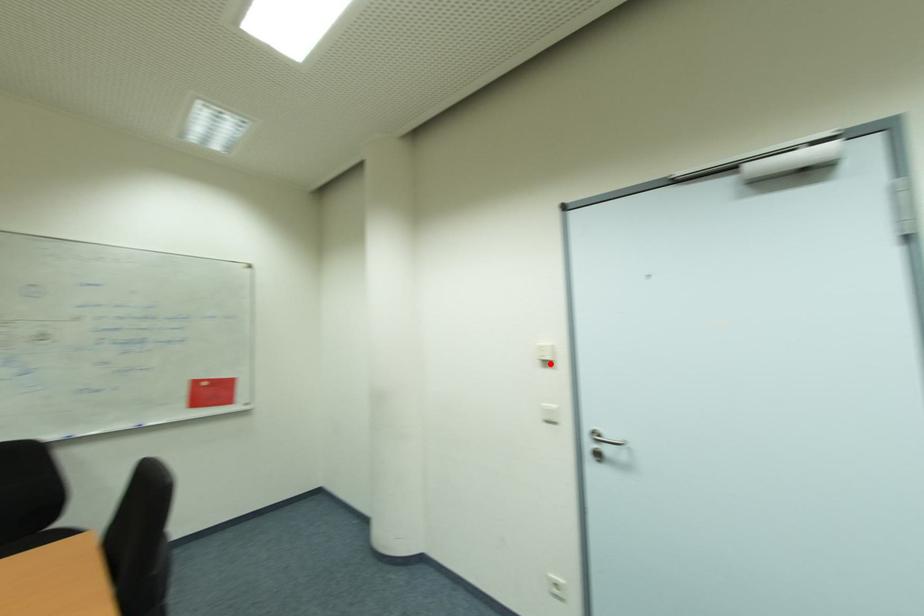
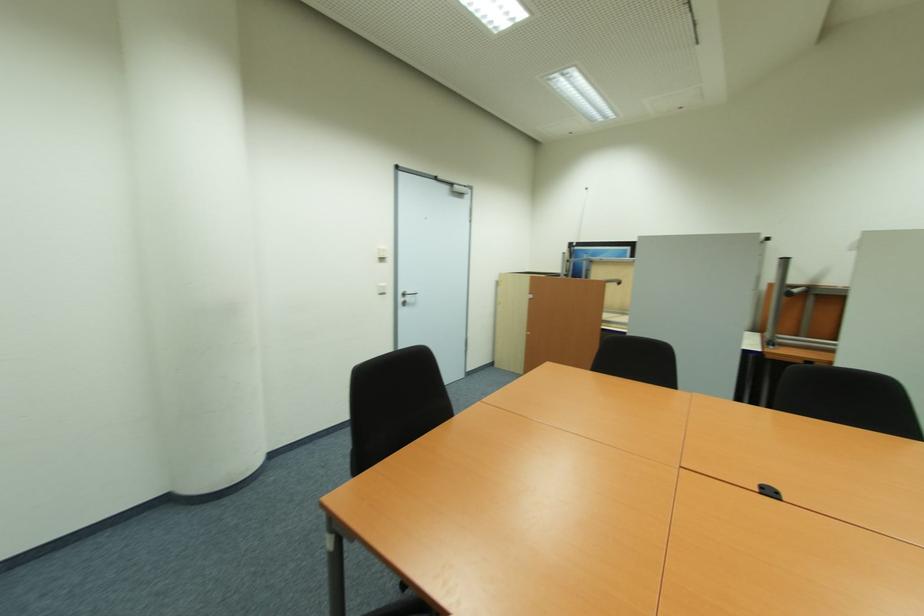
Find the pixel in the second image that matches the highlighted location in the first image.

(385, 260)